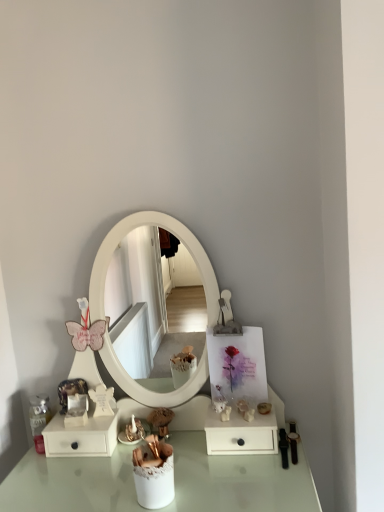
Question: In terms of width, does matte gold figurine at lower center look wider or thinner when compared to white matte drawer at lower left, positioned as the 2th dresser in right-to-left order?

Choices:
 (A) thin
 (B) wide

Answer: (A)

Question: Based on their sizes in the image, would you say matte gold figurine at lower center is bigger or smaller than white matte drawer at lower left, positioned as the 2th dresser in right-to-left order?

Choices:
 (A) small
 (B) big

Answer: (A)

Question: Which object is positioned farthest from the white matte drawer at lower right, placed as the second dresser when sorted from left to right?

Choices:
 (A) white matte drawer at lower left, positioned as the 2th dresser in right-to-left order
 (B) matte gold figurine at lower center

Answer: (A)

Question: Which object is the farthest from the white matte drawer at lower right, placed as the second dresser when sorted from left to right?

Choices:
 (A) white matte drawer at lower left, positioned as the 2th dresser in right-to-left order
 (B) matte gold figurine at lower center

Answer: (A)